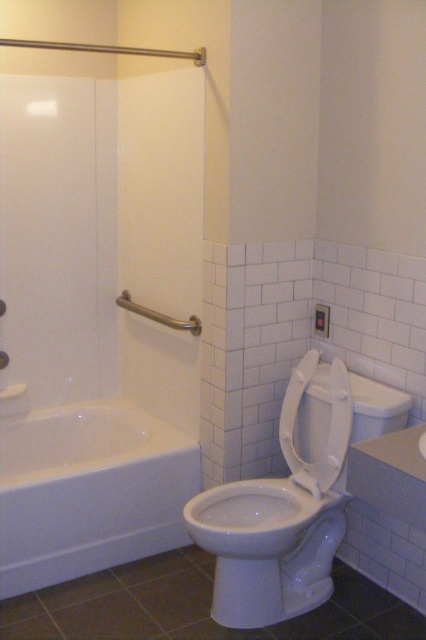
Question: Which is nearer to the white glossy toilet at lower right?

Choices:
 (A) white glossy screen door at left
 (B) white glossy bathtub at lower left
 (C) white glossy toilet bowl at center
 (D) brushed metal grab bar at upper left

Answer: (C)

Question: Among these points, which one is nearest to the camera?

Choices:
 (A) (340, 500)
 (B) (219, 497)

Answer: (A)

Question: Which point appears farthest from the camera in this image?

Choices:
 (A) (158, 483)
 (B) (316, 540)

Answer: (A)

Question: Can you confirm if white glossy screen door at left is positioned to the right of white glossy toilet bowl at center?

Choices:
 (A) yes
 (B) no

Answer: (B)

Question: Does white glossy screen door at left have a lesser width compared to white glossy toilet at lower right?

Choices:
 (A) yes
 (B) no

Answer: (A)

Question: Does white glossy bathtub at lower left appear under brushed metal grab bar at upper left?

Choices:
 (A) no
 (B) yes

Answer: (B)